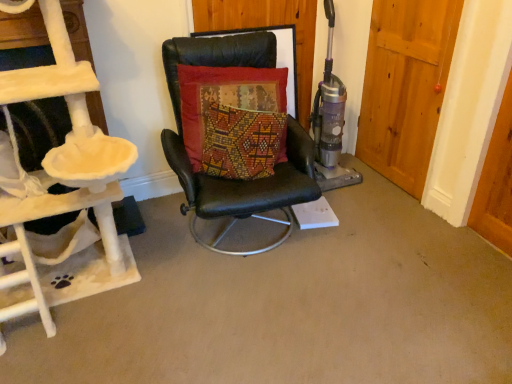
Question: Is wooden door at right bigger than beige plush cat tree at left?

Choices:
 (A) no
 (B) yes

Answer: (A)

Question: Is wooden door at right not within beige plush cat tree at left?

Choices:
 (A) yes
 (B) no

Answer: (A)

Question: Is wooden door at right directly adjacent to beige plush cat tree at left?

Choices:
 (A) no
 (B) yes

Answer: (A)

Question: Is wooden door at right positioned behind beige plush cat tree at left?

Choices:
 (A) no
 (B) yes

Answer: (B)

Question: Does wooden door at right have a greater height compared to beige plush cat tree at left?

Choices:
 (A) yes
 (B) no

Answer: (B)

Question: Can you confirm if wooden door at right is shorter than beige plush cat tree at left?

Choices:
 (A) yes
 (B) no

Answer: (A)

Question: Considering the relative sizes of beige plush cat tree at left and wooden door at right in the image provided, is beige plush cat tree at left taller than wooden door at right?

Choices:
 (A) no
 (B) yes

Answer: (B)

Question: Is beige plush cat tree at left looking in the opposite direction of wooden door at right?

Choices:
 (A) yes
 (B) no

Answer: (B)

Question: From the image's perspective, would you say beige plush cat tree at left is positioned over wooden door at right?

Choices:
 (A) yes
 (B) no

Answer: (B)

Question: From a real-world perspective, does beige plush cat tree at left sit lower than wooden door at right?

Choices:
 (A) no
 (B) yes

Answer: (A)

Question: Is beige plush cat tree at left to the right of wooden door at right from the viewer's perspective?

Choices:
 (A) yes
 (B) no

Answer: (B)

Question: Would you say beige plush cat tree at left contains wooden door at right?

Choices:
 (A) no
 (B) yes

Answer: (A)

Question: Can we say velvet cushion at center lies outside black leather chair at center?

Choices:
 (A) yes
 (B) no

Answer: (B)